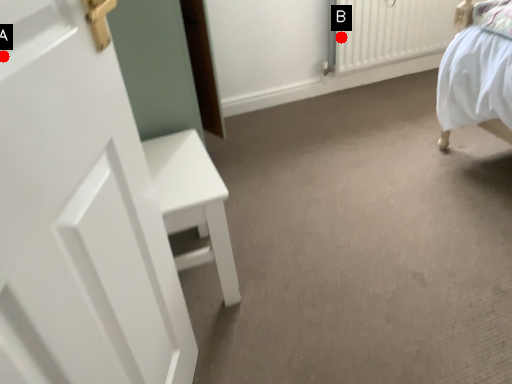
Question: Two points are circled on the image, labeled by A and B beside each circle. Which of the following is the farthest from the observer?

Choices:
 (A) A is further
 (B) B is further

Answer: (B)